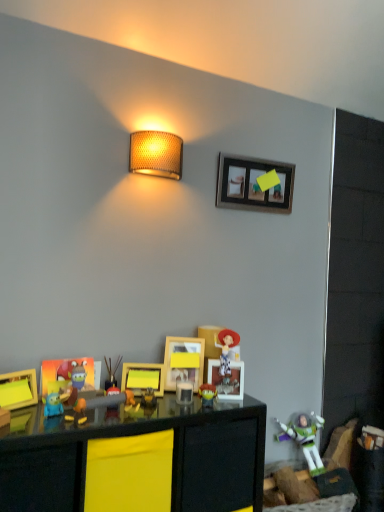
Question: Is matte plastic toy at center, positioned as the 3th toy in right-to-left order, turned away from matte blue toy at lower left, positioned as the fourth toy in back-to-front order?

Choices:
 (A) no
 (B) yes

Answer: (A)

Question: Could you tell me if matte plastic toy at center, which is the 2th toy in back-to-front order, is facing matte blue toy at lower left, the 4th toy positioned from the right?

Choices:
 (A) no
 (B) yes

Answer: (A)

Question: Is matte plastic toy at center, positioned as the 3th toy in right-to-left order, bigger than matte blue toy at lower left, the 4th toy positioned from the right?

Choices:
 (A) no
 (B) yes

Answer: (B)

Question: From a real-world perspective, is matte plastic toy at center, the 2th toy viewed from the left, on matte blue toy at lower left, positioned as the 1th toy in front-to-back order?

Choices:
 (A) no
 (B) yes

Answer: (B)

Question: Can you confirm if matte plastic toy at center, which is the 2th toy in back-to-front order, is taller than matte blue toy at lower left, positioned as the 1th toy in front-to-back order?

Choices:
 (A) yes
 (B) no

Answer: (A)

Question: Is wooden picture frame at upper center, acting as the 5th picture frame starting from the bottom, bigger or smaller than yellow matte picture frame at center, which ranks as the third picture frame in back-to-front order?

Choices:
 (A) small
 (B) big

Answer: (B)

Question: Based on their positions, is wooden picture frame at upper center, the first picture frame in the right-to-left sequence, located to the left or right of yellow matte picture frame at center, the 5th picture frame viewed from the top?

Choices:
 (A) left
 (B) right

Answer: (B)

Question: From a real-world perspective, is wooden picture frame at upper center, marked as the first picture frame in a back-to-front arrangement, above or below yellow matte picture frame at center, the 5th picture frame viewed from the top?

Choices:
 (A) above
 (B) below

Answer: (A)

Question: Is wooden picture frame at upper center, marked as the first picture frame in a back-to-front arrangement, in front of or behind yellow matte picture frame at center, acting as the first picture frame starting from the bottom, in the image?

Choices:
 (A) front
 (B) behind

Answer: (B)

Question: From the image's perspective, is plastic buzz lightyear at lower right, which is the 1th toy in right-to-left order, above or below black glossy table at lower center?

Choices:
 (A) below
 (B) above

Answer: (A)

Question: Is plastic buzz lightyear at lower right, which is counted as the 4th toy, starting from the left, spatially inside black glossy table at lower center, or outside of it?

Choices:
 (A) outside
 (B) inside

Answer: (A)

Question: In terms of width, does plastic buzz lightyear at lower right, arranged as the 4th toy when viewed from the front, look wider or thinner when compared to black glossy table at lower center?

Choices:
 (A) wide
 (B) thin

Answer: (B)

Question: From a real-world perspective, is plastic buzz lightyear at lower right, which is the 4th toy in top-to-bottom order, physically located above or below black glossy table at lower center?

Choices:
 (A) below
 (B) above

Answer: (A)

Question: Relative to matte plastic toy at center, arranged as the third toy when viewed from the top, is yellow matte picture frame at center, the 3th picture frame in the left-to-right sequence, in front or behind?

Choices:
 (A) front
 (B) behind

Answer: (B)

Question: From the image's perspective, relative to matte plastic toy at center, arranged as the third toy when viewed from the top, is yellow matte picture frame at center, the 3th picture frame in the left-to-right sequence, above or below?

Choices:
 (A) above
 (B) below

Answer: (A)